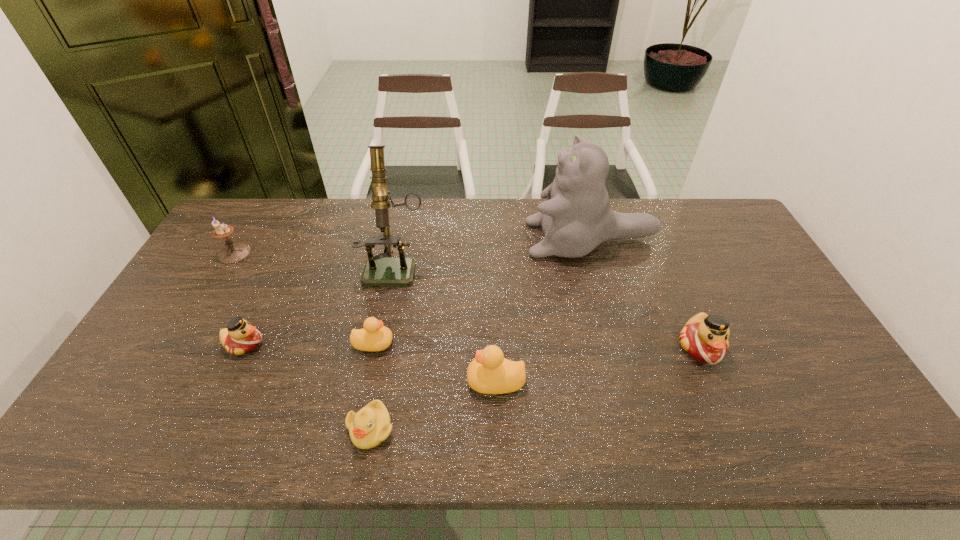
This screenshot has height=540, width=960. Identify the location of vacant space located 0.310m on the face of the bigger yellow duck. (345, 381).

You are a GUI agent. You are given a task and a screenshot of the screen. Output one action in this format:
    pyautogui.click(x=<x>, y=<y>)
    Task: Click on the vacant space located on the face of the bigger yellow duck
    This screenshot has width=960, height=540.
    Given the screenshot: What is the action you would take?
    pyautogui.click(x=372, y=381)

At what (x,y) coordinates should I click in order to perform the action: click on free space located 0.070m on the face of the bigger yellow duck. Please return your answer as a coordinate pair (x, y). Looking at the image, I should click on (440, 381).

Where is `vacant region located on the face of the smaller red duck`? The image size is (960, 540). vacant region located on the face of the smaller red duck is located at coordinates (338, 344).

This screenshot has height=540, width=960. I want to click on vacant space located 0.190m on the face of the smaller yellow duck, so click(463, 343).

The height and width of the screenshot is (540, 960). Find the location of `object situated at the far edge`. object situated at the far edge is located at coordinates (576, 217).

Identify the location of object present at the near edge. The height and width of the screenshot is (540, 960). (371, 425).

You are a GUI agent. You are given a task and a screenshot of the screen. Output one action in this format:
    pyautogui.click(x=<x>, y=<y>)
    Task: Click on the object at the left edge
    This screenshot has height=540, width=960.
    Given the screenshot: What is the action you would take?
    coord(233,252)

In the image, there is a desktop. At what (x,y) coordinates should I click in order to perform the action: click on vacant space at the far edge. Please return your answer as a coordinate pair (x, y). This screenshot has height=540, width=960. Looking at the image, I should click on (420, 236).

In the image, there is a desktop. Identify the location of free space at the near edge. The image size is (960, 540). (248, 438).